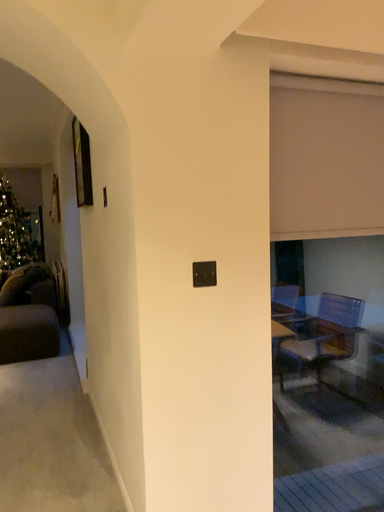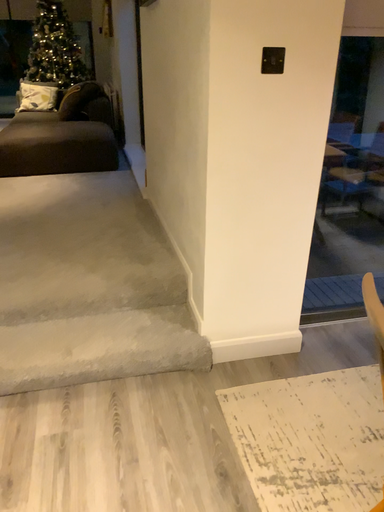
Question: How did the camera likely rotate when shooting the video?

Choices:
 (A) rotated upward
 (B) rotated downward

Answer: (B)